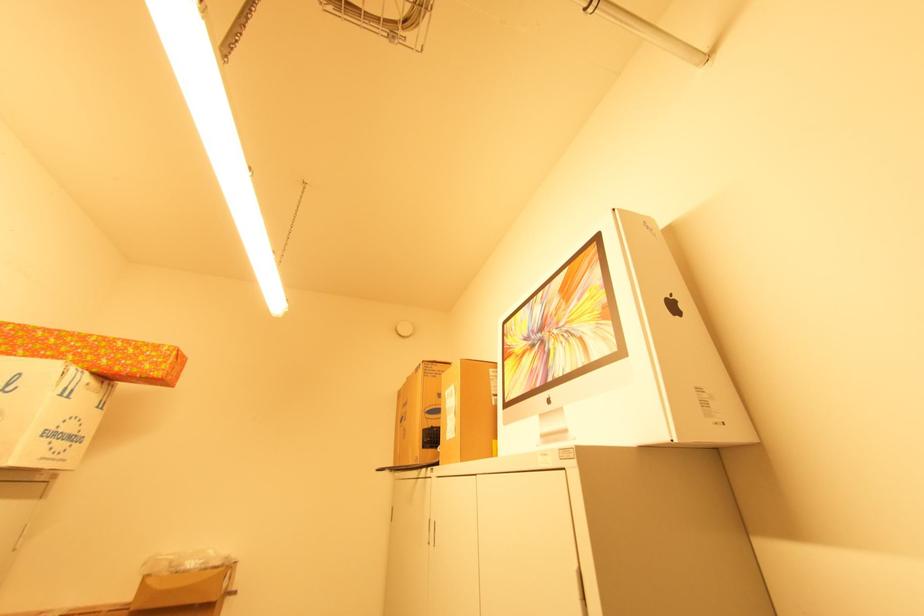
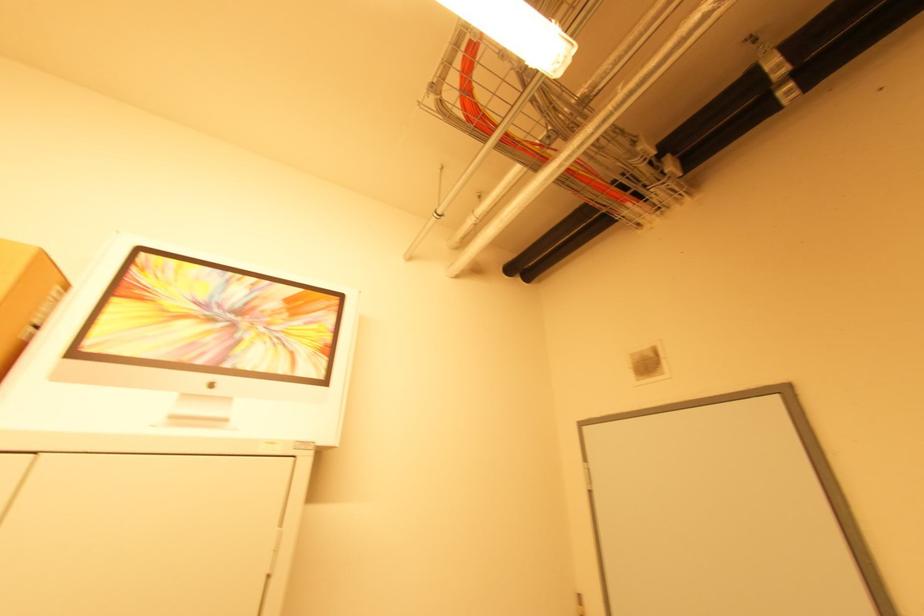
The point at (495, 398) is marked in the first image. Where is the corresponding point in the second image?

(32, 329)